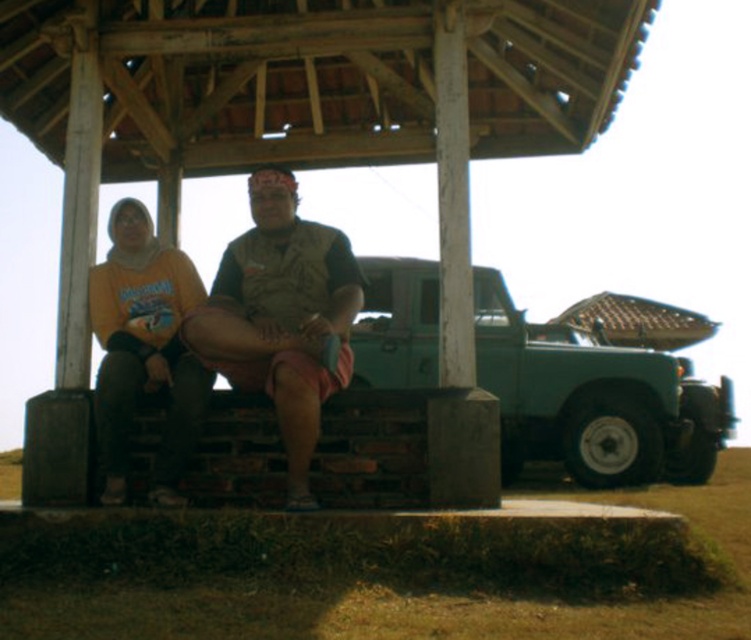
Question: Which point is farther to the camera?

Choices:
 (A) matte yellow hoodie at left
 (B) camouflage fabric shirt at center

Answer: (A)

Question: Which object is farther from the camera taking this photo?

Choices:
 (A) matte yellow hoodie at left
 (B) camouflage fabric shirt at center

Answer: (A)

Question: In this image, where is camouflage fabric shirt at center located relative to matte yellow hoodie at left?

Choices:
 (A) above
 (B) below

Answer: (A)

Question: Which object appears closest to the camera in this image?

Choices:
 (A) camouflage fabric shirt at center
 (B) matte yellow hoodie at left

Answer: (A)

Question: Does camouflage fabric shirt at center have a smaller size compared to matte yellow hoodie at left?

Choices:
 (A) yes
 (B) no

Answer: (B)

Question: Is camouflage fabric shirt at center thinner than matte yellow hoodie at left?

Choices:
 (A) no
 (B) yes

Answer: (A)